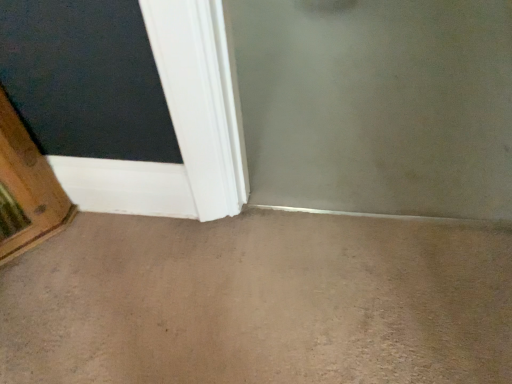
Locate an element on the screen. This screenshot has width=512, height=384. wooden at left is located at coordinates (26, 189).

Image resolution: width=512 pixels, height=384 pixels. What do you see at coordinates (26, 189) in the screenshot? I see `wooden at left` at bounding box center [26, 189].

Find the location of `wooden at left`. wooden at left is located at coordinates (26, 189).